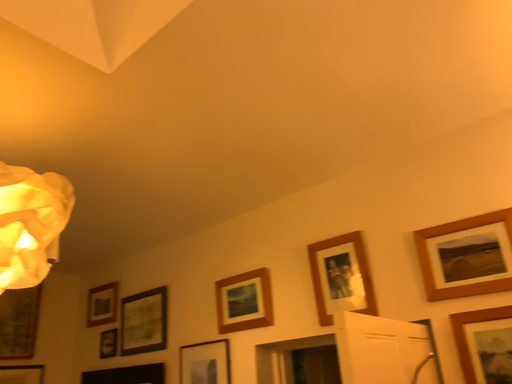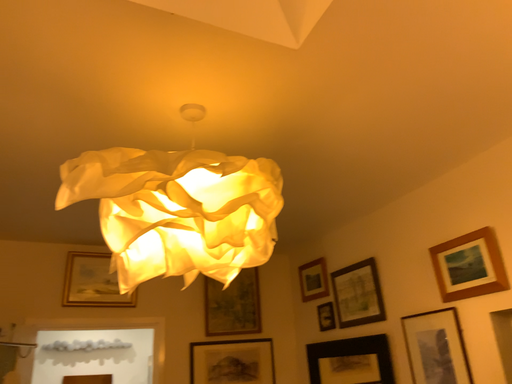
Question: Which way did the camera rotate in the video?

Choices:
 (A) rotated right
 (B) rotated left

Answer: (B)